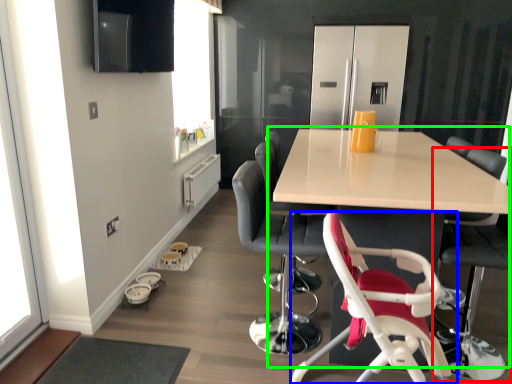
Question: Which object is positioned closest to chair (highlighted by a red box)? Select from chair (highlighted by a blue box) and table (highlighted by a green box).

Choices:
 (A) chair
 (B) table

Answer: (A)